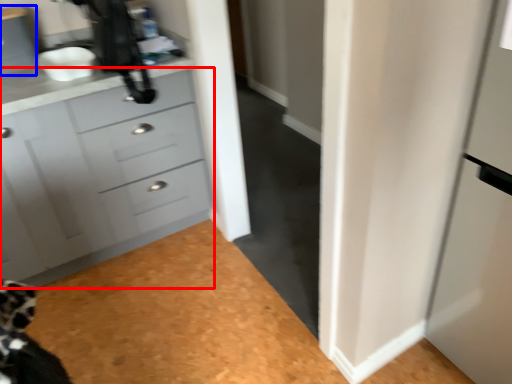
Question: Which point is closer to the camera, chest of drawers (highlighted by a red box) or cabinetry (highlighted by a blue box)?

Choices:
 (A) chest of drawers
 (B) cabinetry

Answer: (A)